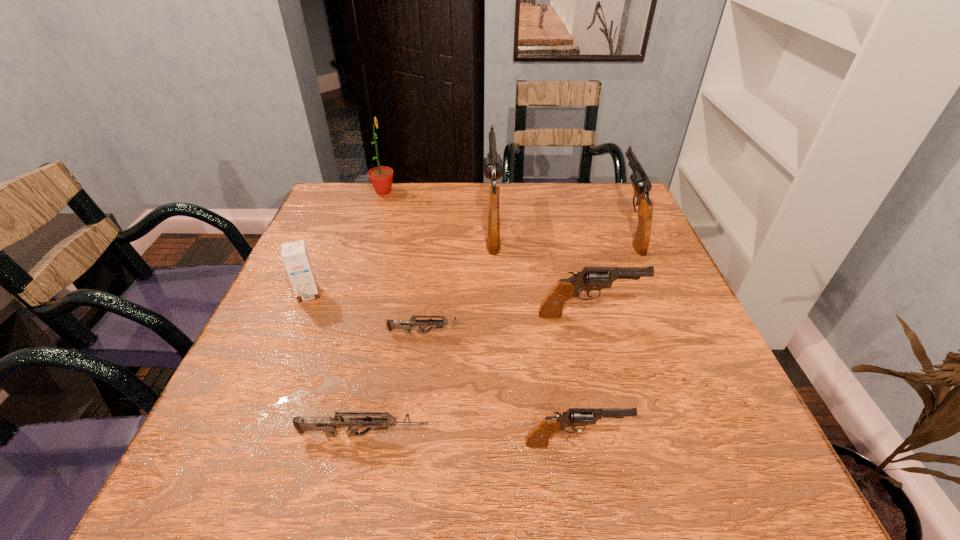
The height and width of the screenshot is (540, 960). I want to click on free space between the green sunflower and the tallest gun, so click(x=438, y=205).

Locate an element on the screen. The width and height of the screenshot is (960, 540). free space between the second shortest gun and the third farthest black gun is located at coordinates (477, 375).

Find the location of `vacant point located between the fourth gun from right to left and the green sunflower`. vacant point located between the fourth gun from right to left and the green sunflower is located at coordinates (438, 205).

Image resolution: width=960 pixels, height=540 pixels. In order to click on vacant space that's between the leftmost black gun and the rightmost object in this screenshot , I will do `click(561, 222)`.

Locate an element on the screen. The image size is (960, 540). vacant space that's between the leftmost object and the seventh tallest object is located at coordinates (337, 364).

Identify the location of object that is the sixth closest to the third shortest object. The height and width of the screenshot is (540, 960). (294, 254).

Identify which object is the fourth closest to the sunflower. Please provide its 2D coordinates. Your answer should be formatted as a tuple, i.e. [(x, y)], where the tuple contains the x and y coordinates of a point satisfying the conditions above.

[(590, 278)]

Select which gun is the second closest to the fourth farthest object. Please provide its 2D coordinates. Your answer should be formatted as a tuple, i.e. [(x, y)], where the tuple contains the x and y coordinates of a point satisfying the conditions above.

[(328, 425)]

You are a GUI agent. You are given a task and a screenshot of the screen. Output one action in this format:
    pyautogui.click(x=<x>, y=<y>)
    Task: Click on the gun identified as the fourth closest to the leftmost black gun
    
    Given the screenshot: What is the action you would take?
    pyautogui.click(x=328, y=425)

You are a GUI agent. You are given a task and a screenshot of the screen. Output one action in this format:
    pyautogui.click(x=<x>, y=<y>)
    Task: Click on the black gun that can be found as the fourth closest to the green sunflower
    The width and height of the screenshot is (960, 540).
    Given the screenshot: What is the action you would take?
    pyautogui.click(x=538, y=438)